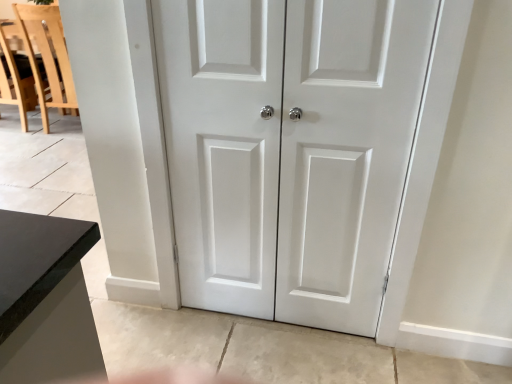
Question: From a real-world perspective, is white matte door at center located beneath white matte door at center?

Choices:
 (A) yes
 (B) no

Answer: (A)

Question: Is white matte door at center closer to the viewer compared to white matte door at center?

Choices:
 (A) no
 (B) yes

Answer: (B)

Question: Is white matte door at center positioned with its back to white matte door at center?

Choices:
 (A) no
 (B) yes

Answer: (B)

Question: Does white matte door at center appear on the left side of white matte door at center?

Choices:
 (A) no
 (B) yes

Answer: (A)

Question: Is white matte door at center shorter than white matte door at center?

Choices:
 (A) yes
 (B) no

Answer: (B)

Question: From the image's perspective, is white matte door at center under white matte door at center?

Choices:
 (A) yes
 (B) no

Answer: (A)

Question: Is white matte door at center closer to camera compared to light wood chair at left?

Choices:
 (A) yes
 (B) no

Answer: (A)

Question: From a real-world perspective, is white matte door at center on light wood chair at left?

Choices:
 (A) no
 (B) yes

Answer: (B)

Question: Can light wood chair at left be found inside white matte door at center?

Choices:
 (A) yes
 (B) no

Answer: (B)

Question: Does white matte door at center come behind light wood chair at left?

Choices:
 (A) yes
 (B) no

Answer: (B)

Question: Does white matte door at center have a greater height compared to light wood chair at left?

Choices:
 (A) yes
 (B) no

Answer: (A)

Question: Considering the relative sizes of white matte door at center and light wood chair at left in the image provided, is white matte door at center wider than light wood chair at left?

Choices:
 (A) yes
 (B) no

Answer: (B)

Question: Is light wood chair at left facing towards white matte door at center?

Choices:
 (A) no
 (B) yes

Answer: (A)